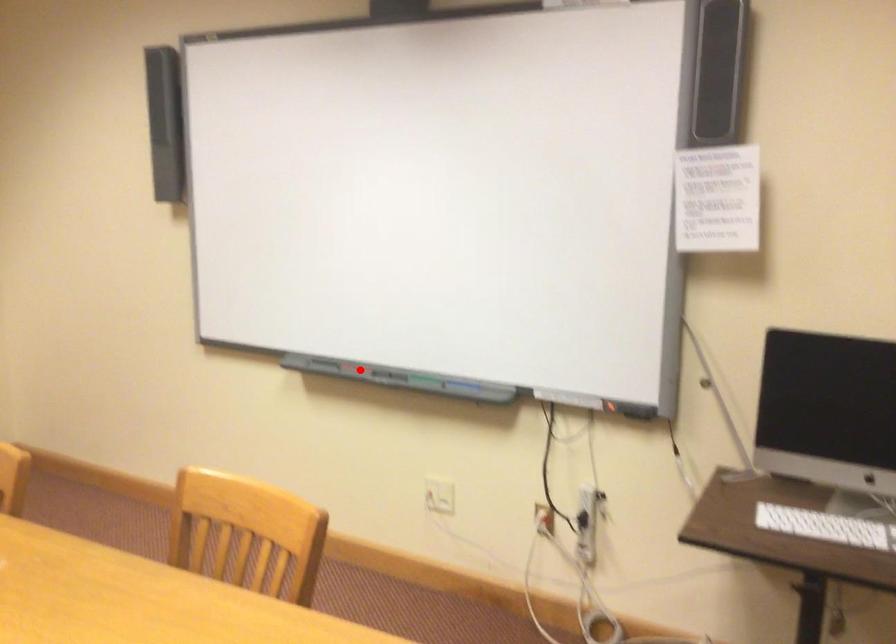
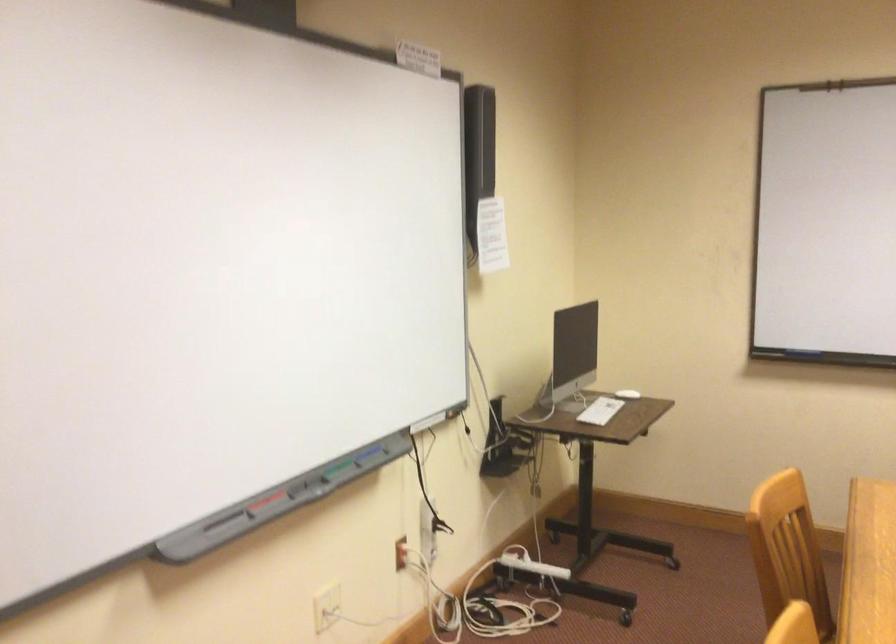
Find the pixel in the second image that matches the highlighted location in the first image.

(264, 502)